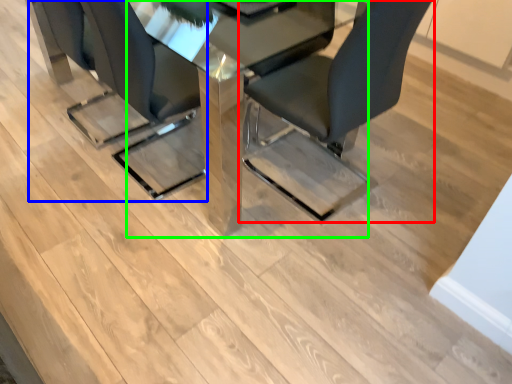
Question: Estimate the real-world distances between objects in this image. Which object is farther from chair (highlighted by a red box), chair (highlighted by a blue box) or table (highlighted by a green box)?

Choices:
 (A) chair
 (B) table

Answer: (A)